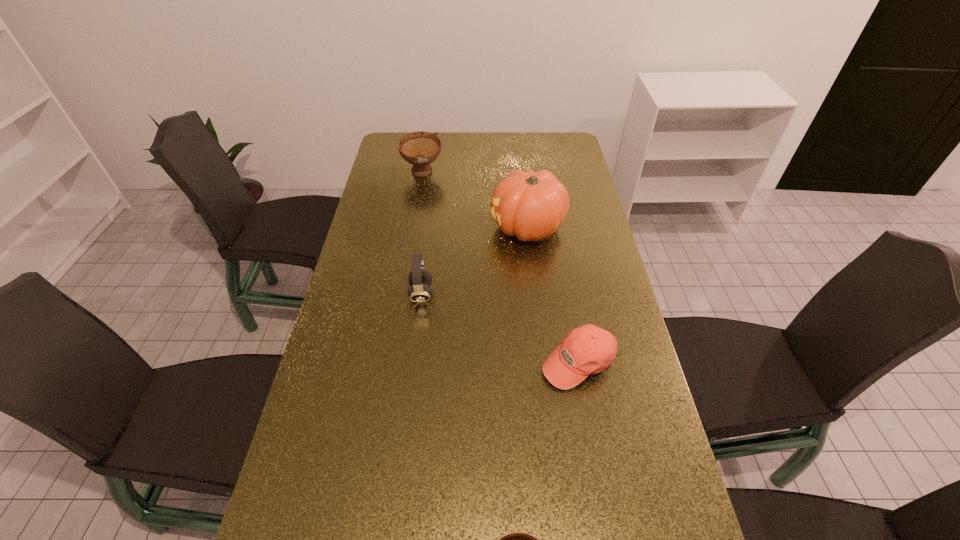
Identify the location of vacant space at the far right corner of the desktop. (571, 158).

Find the location of a particular element. The height and width of the screenshot is (540, 960). vacant area between the left soup bowl and the fourth tallest object is located at coordinates (500, 268).

Identify the location of free space between the tallest object and the taller soup bowl. (475, 201).

What are the coordinates of `free space that is in between the baseball cap and the pumpkin` in the screenshot? It's located at (553, 295).

Where is `free space between the farther soup bowl and the headset`? This screenshot has width=960, height=540. free space between the farther soup bowl and the headset is located at coordinates (422, 234).

This screenshot has width=960, height=540. I want to click on blank region between the second shortest object and the pumpkin, so click(x=553, y=295).

Locate an element on the screen. This screenshot has height=540, width=960. blank region between the headset and the left soup bowl is located at coordinates (422, 234).

At what (x,y) coordinates should I click in order to perform the action: click on vacant space that is in between the tallest object and the third nearest object. Please return your answer as a coordinate pair (x, y). The width and height of the screenshot is (960, 540). Looking at the image, I should click on (474, 261).

This screenshot has height=540, width=960. I want to click on free spot between the tallest object and the second nearest object, so click(553, 295).

Locate which object is the closest to the left soup bowl. Please provide its 2D coordinates. Your answer should be formatted as a tuple, i.e. [(x, y)], where the tuple contains the x and y coordinates of a point satisfying the conditions above.

[(530, 205)]